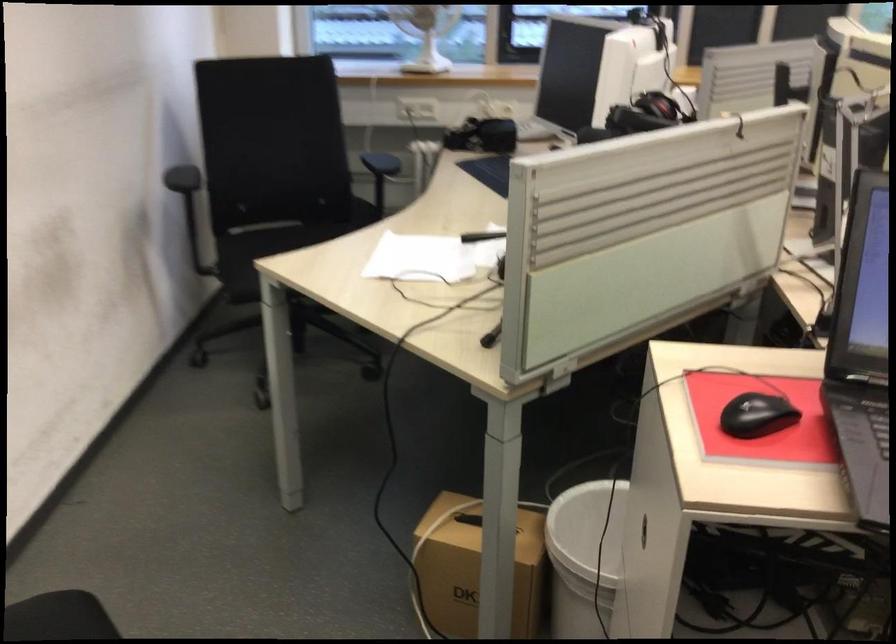
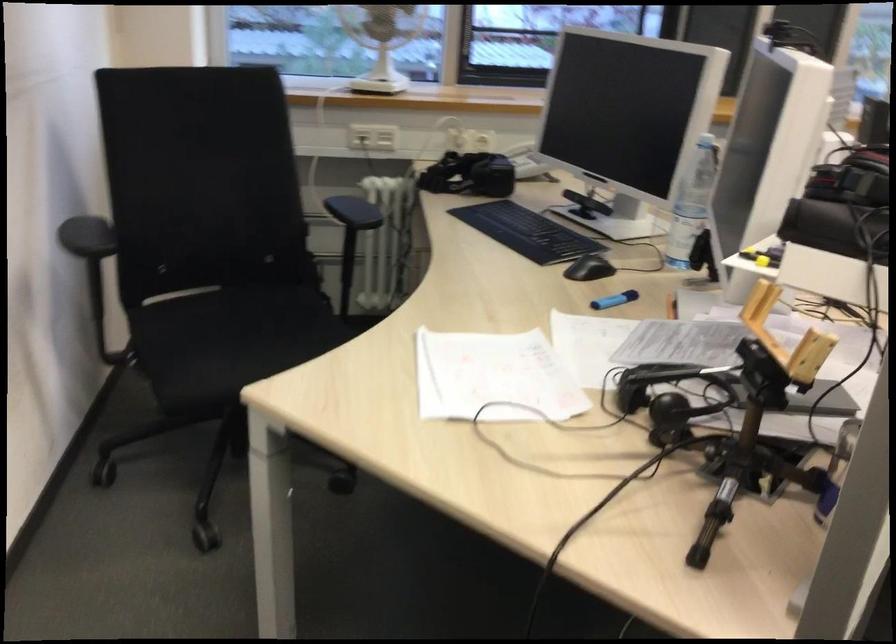
Question: The camera is either moving clockwise (left) or counter-clockwise (right) around the object. The first image is from the beginning of the video and the second image is from the end. Is the camera moving left or right when shooting the video?

Choices:
 (A) Left
 (B) Right

Answer: (A)